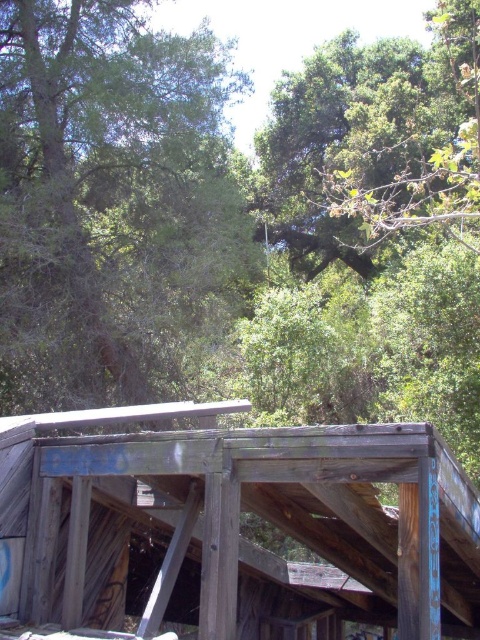
You are an explorer in a dense forest and need to find shelter. You see the weathered wood shelter at center and the green leafy tree at upper center. Which one is larger in size?

The weathered wood shelter at center is bigger than the green leafy tree at upper center, so the shelter is larger in size.

You are an explorer navigating through the forest and spot the weathered wood shelter at center and the green leafy tree at upper center. Which object is closer to your left side when facing the scene?

The green leafy tree at upper center is closer to your left side because the weathered wood shelter at center is positioned on the right side of it.

You are standing in a forest and see the weathered wood shelter at center and the green leafy tree at upper center. Which object is closer to you?

The weathered wood shelter at center is closer to you because it is in front of the green leafy tree at upper center.